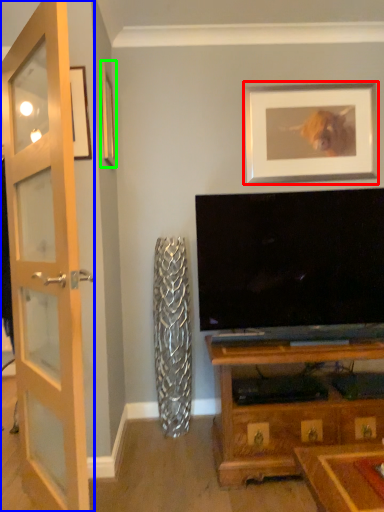
Question: Estimate the real-world distances between objects in this image. Which object is closer to picture frame (highlighted by a red box), door (highlighted by a blue box) or picture frame (highlighted by a green box)?

Choices:
 (A) door
 (B) picture frame

Answer: (B)